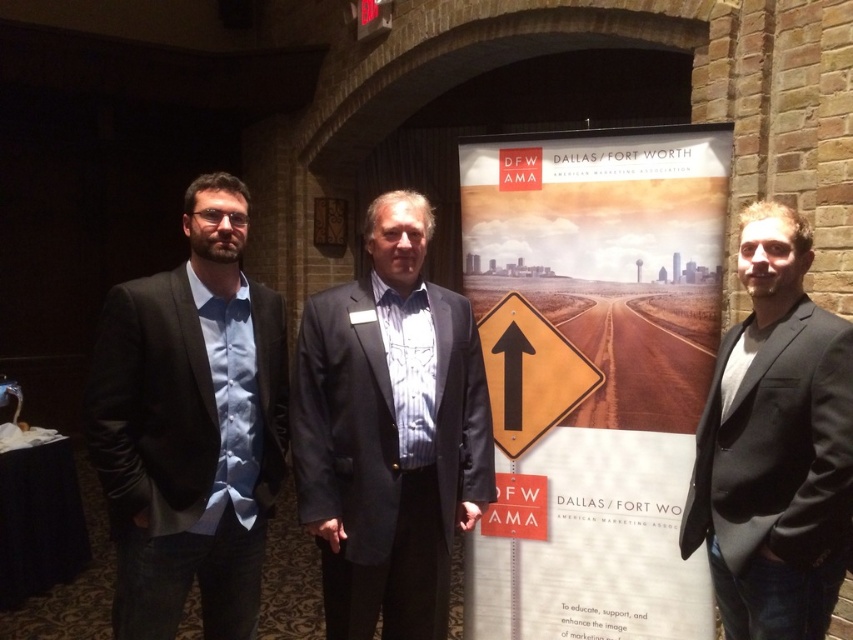
Question: Is yellow reflective plastic road sign at center behind yellowmaterial/texturestreet sign at center?

Choices:
 (A) yes
 (B) no

Answer: (B)

Question: Which point is closer to the camera taking this photo?

Choices:
 (A) (247, 204)
 (B) (291, 424)
 (C) (520, 483)
 (D) (642, 296)

Answer: (A)

Question: Which point is closer to the camera taking this photo?

Choices:
 (A) (426, 234)
 (B) (694, 620)
 (C) (535, 538)
 (D) (575, 372)

Answer: (A)

Question: In this image, where is orange paper sign at center located relative to dark gray suit at center?

Choices:
 (A) left
 (B) right

Answer: (B)

Question: Does orange paper sign at center appear on the right side of dark gray suit at center?

Choices:
 (A) yes
 (B) no

Answer: (A)

Question: Which point appears closest to the camera in this image?

Choices:
 (A) (223, 620)
 (B) (833, 417)
 (C) (675, 435)
 (D) (521, 326)

Answer: (B)